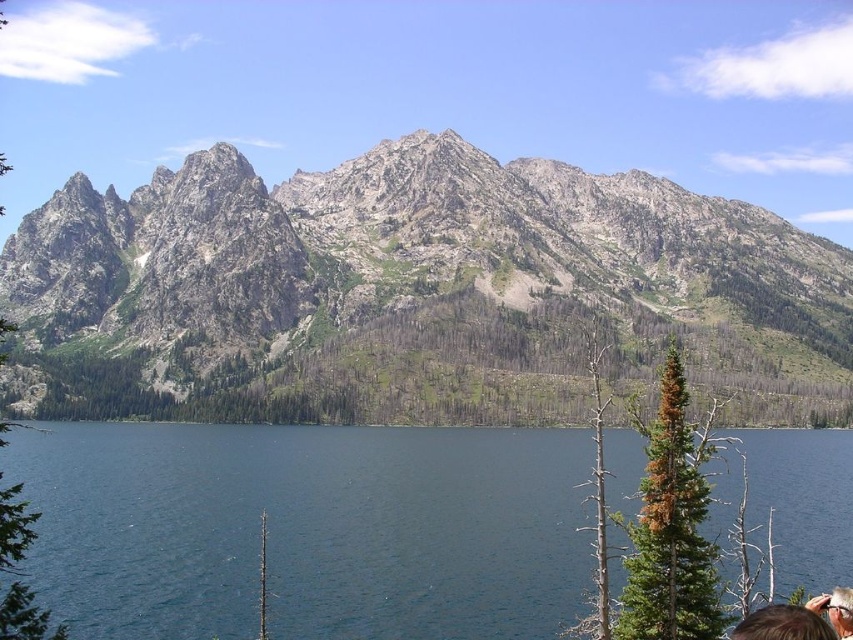
Question: Which point is farther to the camera?

Choices:
 (A) deep blue water at center
 (B) rocky gray mountain at upper center

Answer: (B)

Question: Where is rocky gray mountain at upper center located in relation to deep blue water at center in the image?

Choices:
 (A) below
 (B) above

Answer: (B)

Question: Is the position of rocky gray mountain at upper center less distant than that of deep blue water at center?

Choices:
 (A) no
 (B) yes

Answer: (A)

Question: Among these objects, which one is nearest to the camera?

Choices:
 (A) rocky gray mountain at upper center
 (B) deep blue water at center

Answer: (B)

Question: Can you confirm if rocky gray mountain at upper center is thinner than deep blue water at center?

Choices:
 (A) no
 (B) yes

Answer: (A)

Question: Among these objects, which one is farthest from the camera?

Choices:
 (A) rocky gray mountain at upper center
 (B) deep blue water at center

Answer: (A)